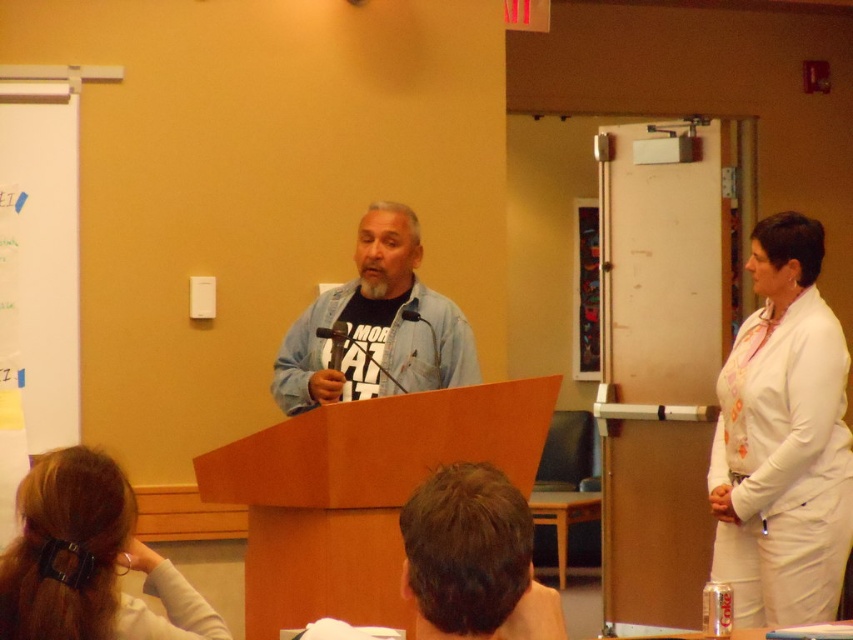
Question: Among these points, which one is nearest to the camera?

Choices:
 (A) (341, 358)
 (B) (53, 620)

Answer: (B)

Question: Is denim jacket at center to the left of metallic black microphone at center from the viewer's perspective?

Choices:
 (A) yes
 (B) no

Answer: (B)

Question: From the image, what is the correct spatial relationship of white fabric blouse at right in relation to metallic black microphone at center?

Choices:
 (A) right
 (B) left

Answer: (A)

Question: Which point is farther to the camera?

Choices:
 (A) metallic black microphone at center
 (B) denim jacket at center
 (C) blonde hair at lower left
 (D) white fabric blouse at right

Answer: (B)

Question: Among these objects, which one is nearest to the camera?

Choices:
 (A) white fabric blouse at right
 (B) blonde hair at lower left
 (C) metallic black microphone at center
 (D) denim jacket at center

Answer: (B)

Question: Does blonde hair at lower left appear on the right side of metallic black microphone at center?

Choices:
 (A) no
 (B) yes

Answer: (A)